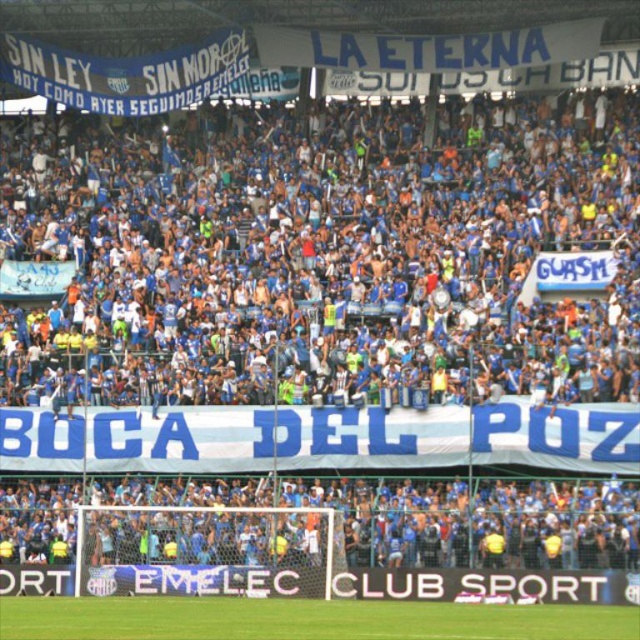
Can you confirm if blue fabric banner at upper center is smaller than blue jersey at lower center?

Actually, blue fabric banner at upper center might be larger than blue jersey at lower center.

Which of these two, blue fabric banner at upper center or blue jersey at lower center, stands shorter?

With less height is blue jersey at lower center.

The width and height of the screenshot is (640, 640). I want to click on blue fabric banner at upper center, so click(321, 256).